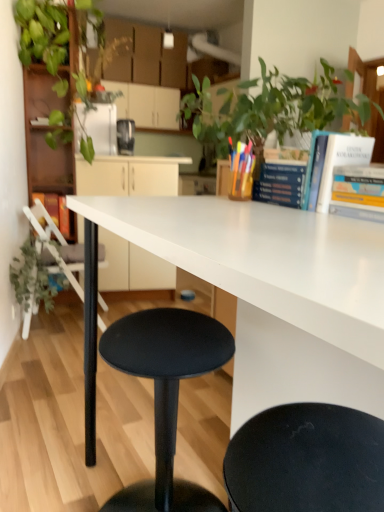
Question: Is hardcover book at center, which ranks as the 3th book in front-to-back order, inside the boundaries of wooden bookshelf at left, or outside?

Choices:
 (A) inside
 (B) outside

Answer: (B)

Question: In terms of width, does hardcover book at center, the 2th book from the left, look wider or thinner when compared to wooden bookshelf at left?

Choices:
 (A) wide
 (B) thin

Answer: (B)

Question: Which object is positioned farthest from the white glossy countertop at center?

Choices:
 (A) metallic black toaster at upper center
 (B) hardcover book at upper right, the second book in the right-to-left sequence
 (C) matte white cabinets at upper center, the 1th cabinetry viewed from the top
 (D) wooden bookshelf at left
 (E) green matte plant at left

Answer: (C)

Question: Which object is positioned closest to the metallic black toaster at upper center?

Choices:
 (A) hardcover book at upper right, marked as the 4th book in a left-to-right arrangement
 (B) hardcover book at upper right, arranged as the third book when viewed from the left
 (C) matte black stool at lower center
 (D) hardcover book at left, placed as the first book when sorted from left to right
 (E) green leafy plant at upper left

Answer: (E)